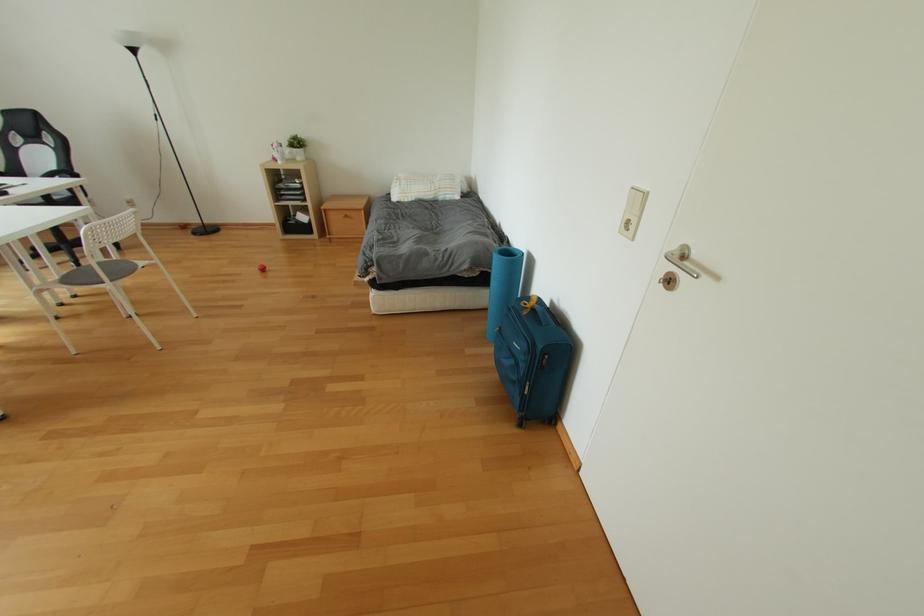
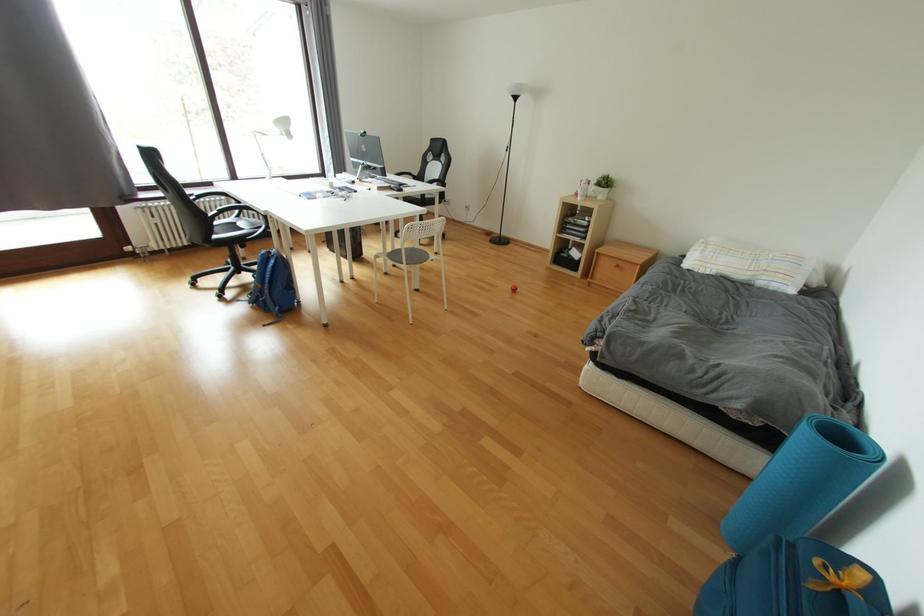
Question: The camera is either moving clockwise (left) or counter-clockwise (right) around the object. The first image is from the beginning of the video and the second image is from the end. Is the camera moving left or right when shooting the video?

Choices:
 (A) Left
 (B) Right

Answer: (B)